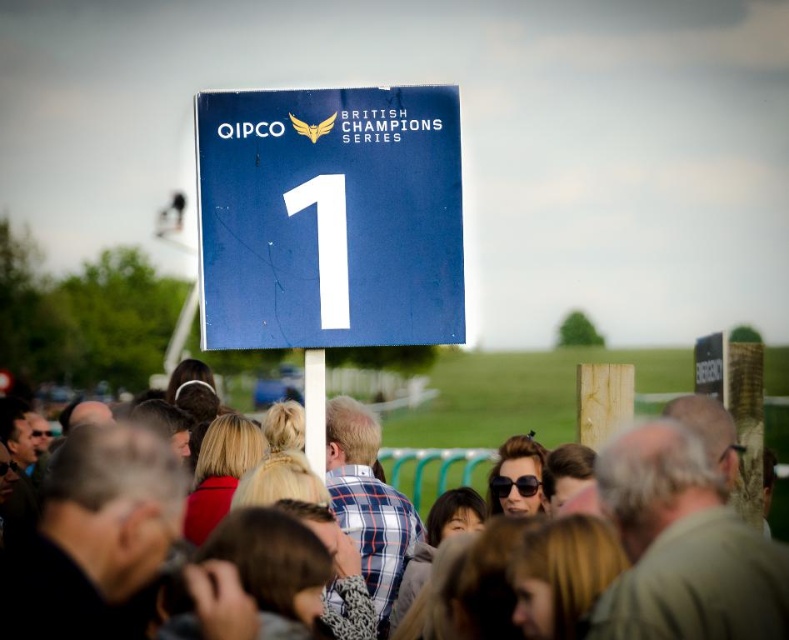
Is blue matte sign at center behind white plastic pole at center?

No.

Is blue matte sign at center wider than white plastic pole at center?

Yes.

What do you see at coordinates (328, 218) in the screenshot?
I see `blue matte sign at center` at bounding box center [328, 218].

At what (x,y) coordinates should I click in order to perform the action: click on blue matte sign at center. Please return your answer as a coordinate pair (x, y). Image resolution: width=789 pixels, height=640 pixels. Looking at the image, I should click on (328, 218).

Which is in front, point (500, 380) or point (313, 380)?

Positioned in front is point (313, 380).

Does matte blue sign at upper center have a smaller size compared to white plastic pole at center?

Incorrect, matte blue sign at upper center is not smaller in size than white plastic pole at center.

Based on the photo, who is more distant from viewer, (x=466, y=433) or (x=312, y=401)?

Point (x=466, y=433)

Locate an element on the screen. Image resolution: width=789 pixels, height=640 pixels. matte blue sign at upper center is located at coordinates (524, 397).

Is blue matte sign at center below matte blue sign at upper center?

Actually, blue matte sign at center is above matte blue sign at upper center.

Between blue matte sign at center and matte blue sign at upper center, which one is positioned lower?

matte blue sign at upper center is below.

The width and height of the screenshot is (789, 640). In order to click on blue matte sign at center in this screenshot , I will do 328,218.

The image size is (789, 640). I want to click on blue matte sign at center, so click(328, 218).